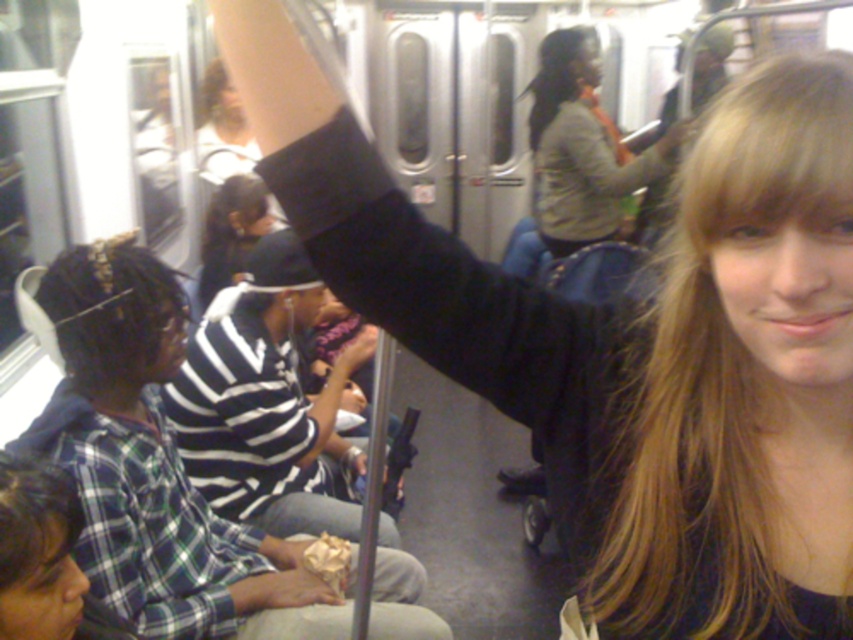
You are a passenger in the subway car and want to know if the plaid shirt at lower left is located below the black striped shirt at center. Based on the scene description, can you confirm this?

Yes, the plaid shirt at lower left is positioned under the black striped shirt at center according to the description.

You are standing in the subway car and want to know the exact coordinates of the plaid shirt at lower left. What are they?

The plaid shirt at lower left is located at coordinates point (151, 461).

Consider the image. You are a photographer trying to capture a candid shot of the plaid shirt at lower left and the black striped shirt at center in the subway car. Since you want to include both shirts in the frame, which shirt should you position closer to the camera to ensure both fit in the photo?

To ensure both the plaid shirt at lower left and the black striped shirt at center fit in the photo, you should position the plaid shirt at lower left closer to the camera. Since its width is larger than the black striped shirt at center, moving it closer will help accommodate its size within the frame.